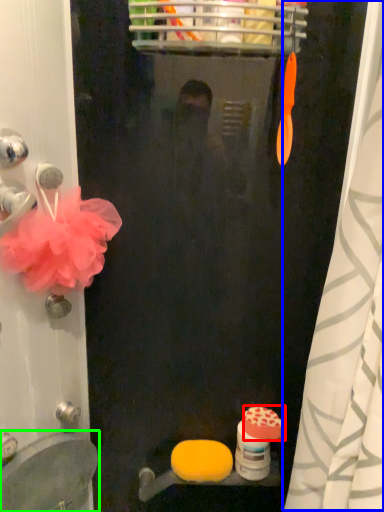
Question: Which object is the farthest from soap (highlighted by a red box)? Choose among these: shower curtain (highlighted by a blue box) or sink (highlighted by a green box).

Choices:
 (A) shower curtain
 (B) sink

Answer: (A)